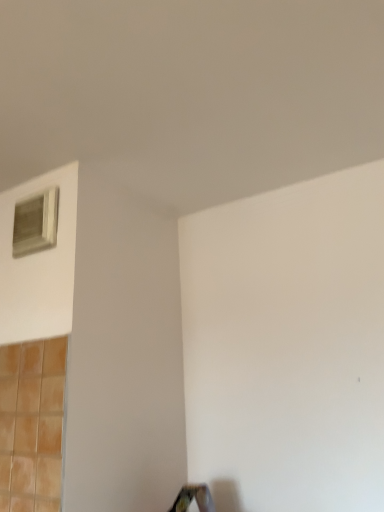
Measure the distance between white wooden window at upper left and camera.

The depth of white wooden window at upper left is 4.34 feet.

This screenshot has width=384, height=512. What do you see at coordinates (36, 223) in the screenshot?
I see `white wooden window at upper left` at bounding box center [36, 223].

In order to click on white wooden window at upper left in this screenshot , I will do `click(36, 223)`.

What is the approximate width of white wooden window at upper left?

It is 4.16 centimeters.

Image resolution: width=384 pixels, height=512 pixels. Identify the location of white wooden window at upper left. (36, 223).